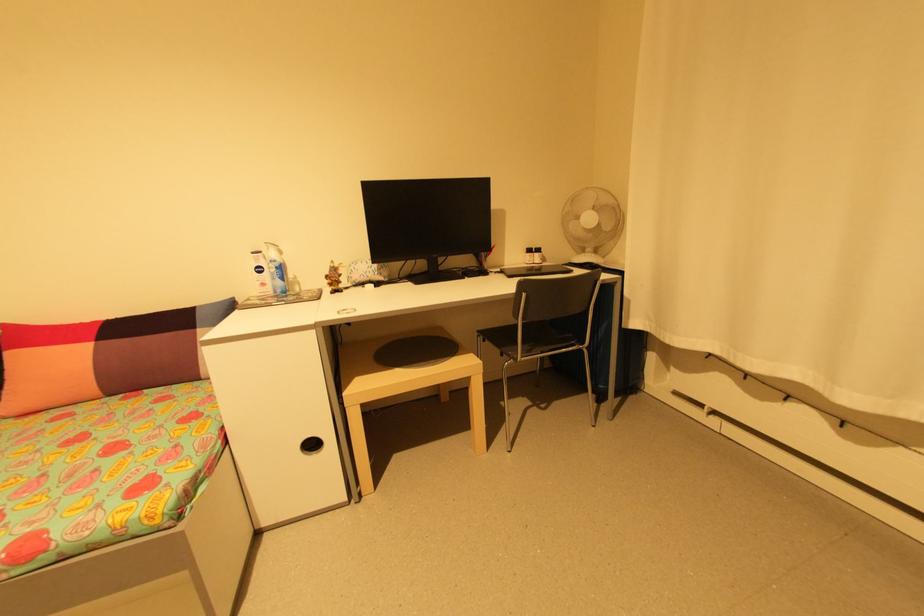
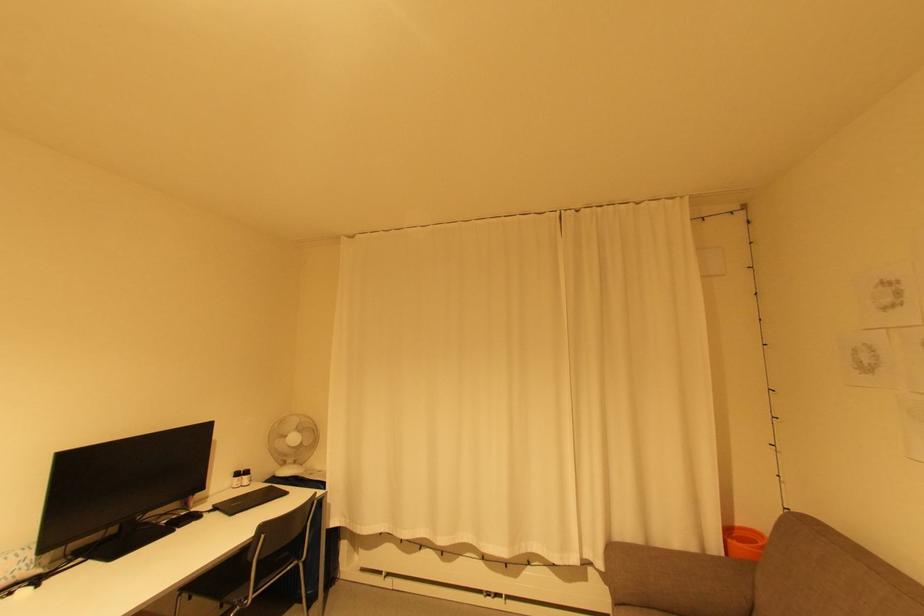
Based on the continuous images, in which direction is the camera rotating?

The camera's rotation is toward right-up.